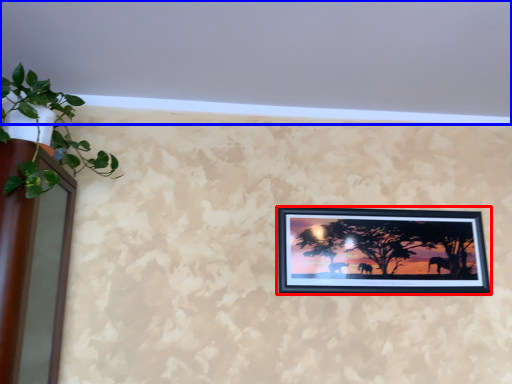
Question: Which object is closer to the camera taking this photo, picture frame (highlighted by a red box) or backdrop (highlighted by a blue box)?

Choices:
 (A) picture frame
 (B) backdrop

Answer: (B)